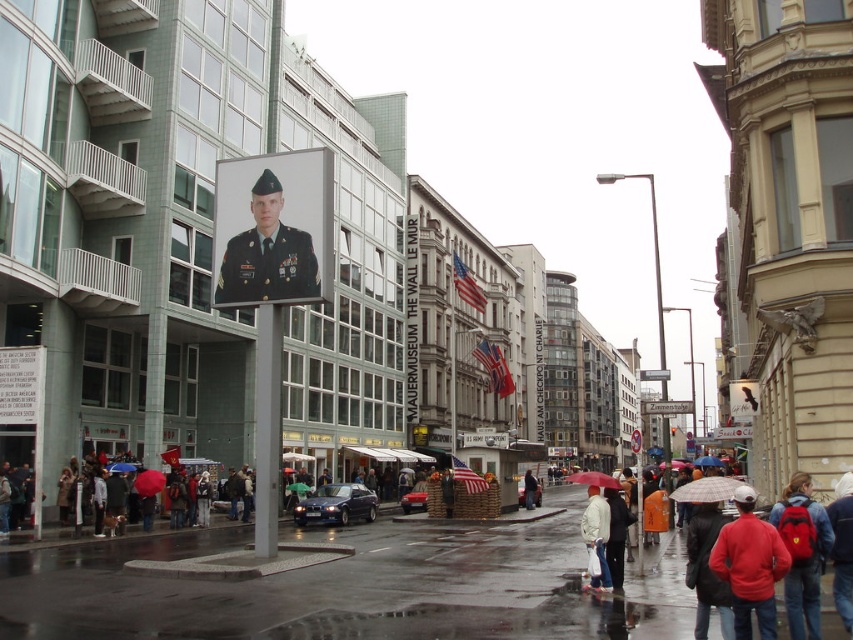
You are a tourist in Berlin holding a red backpack at lower right and a red matte umbrella at center. You want to store your backpack in a locker that has a maximum capacity of 50 liters. Can you determine if your backpack will fit based on the size comparison provided?

The red backpack at lower right is smaller than the red matte umbrella at center. However, without knowing the exact size of the umbrella or the backpack, it is impossible to determine if the backpack will fit in the 50 liter locker. Additional information is needed.

You are a tour guide leading a group through the rainy streets of Berlin. You need to point out both the green military uniform at center and the shiny dark blue sedan at center to your group. How far apart are these two landmarks?

The green military uniform at center and the shiny dark blue sedan at center are 82.50 feet apart.

You are a tourist standing on the rainy street and want to take a photo of both the green military uniform at center and the shiny red car at center. Which object should you focus on first to ensure both are in the frame?

You should focus on the green military uniform at center first because it is closer to you than the shiny red car at center, ensuring both are in the frame.